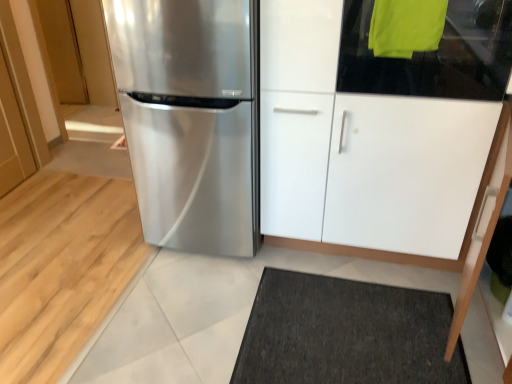
Question: Is satin metallic refrigerator at center completely or partially outside of transparent glass door at upper right?

Choices:
 (A) yes
 (B) no

Answer: (A)

Question: Is satin metallic refrigerator at center behind transparent glass door at upper right?

Choices:
 (A) yes
 (B) no

Answer: (A)

Question: Is satin metallic refrigerator at center to the right of transparent glass door at upper right from the viewer's perspective?

Choices:
 (A) no
 (B) yes

Answer: (A)

Question: Is transparent glass door at upper right inside satin metallic refrigerator at center?

Choices:
 (A) no
 (B) yes

Answer: (A)

Question: Is satin metallic refrigerator at center closer to camera compared to transparent glass door at upper right?

Choices:
 (A) no
 (B) yes

Answer: (A)

Question: From the image's perspective, is satin metallic refrigerator at center located beneath transparent glass door at upper right?

Choices:
 (A) yes
 (B) no

Answer: (A)

Question: From a real-world perspective, is satin metallic refrigerator at center over white glossy cabinet at center?

Choices:
 (A) no
 (B) yes

Answer: (B)

Question: Can you confirm if satin metallic refrigerator at center is thinner than white glossy cabinet at center?

Choices:
 (A) yes
 (B) no

Answer: (A)

Question: From the image's perspective, would you say satin metallic refrigerator at center is shown under white glossy cabinet at center?

Choices:
 (A) yes
 (B) no

Answer: (A)

Question: Considering the relative sizes of satin metallic refrigerator at center and white glossy cabinet at center in the image provided, is satin metallic refrigerator at center taller than white glossy cabinet at center?

Choices:
 (A) no
 (B) yes

Answer: (A)

Question: From a real-world perspective, is satin metallic refrigerator at center beneath white glossy cabinet at center?

Choices:
 (A) yes
 (B) no

Answer: (B)

Question: Is satin metallic refrigerator at center turned away from white glossy cabinet at center?

Choices:
 (A) yes
 (B) no

Answer: (A)

Question: Considering the relative positions of white glossy cabinet at center and satin metallic refrigerator at center in the image provided, is white glossy cabinet at center behind satin metallic refrigerator at center?

Choices:
 (A) yes
 (B) no

Answer: (B)